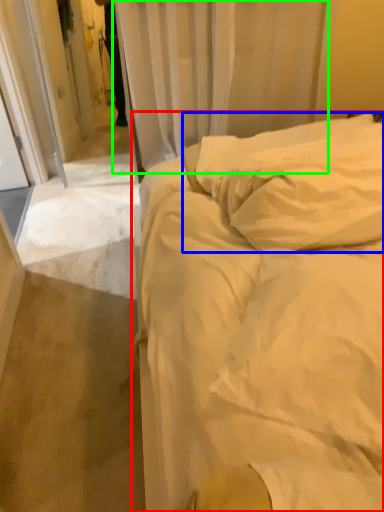
Question: Which object is positioned farthest from bed (highlighted by a red box)? Select from pillow (highlighted by a blue box) and curtain (highlighted by a green box).

Choices:
 (A) pillow
 (B) curtain

Answer: (B)